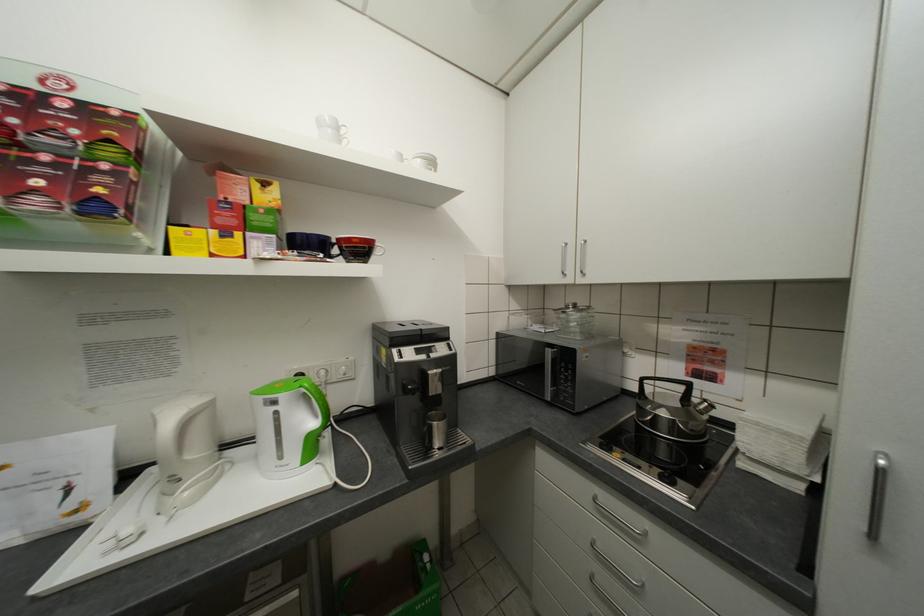
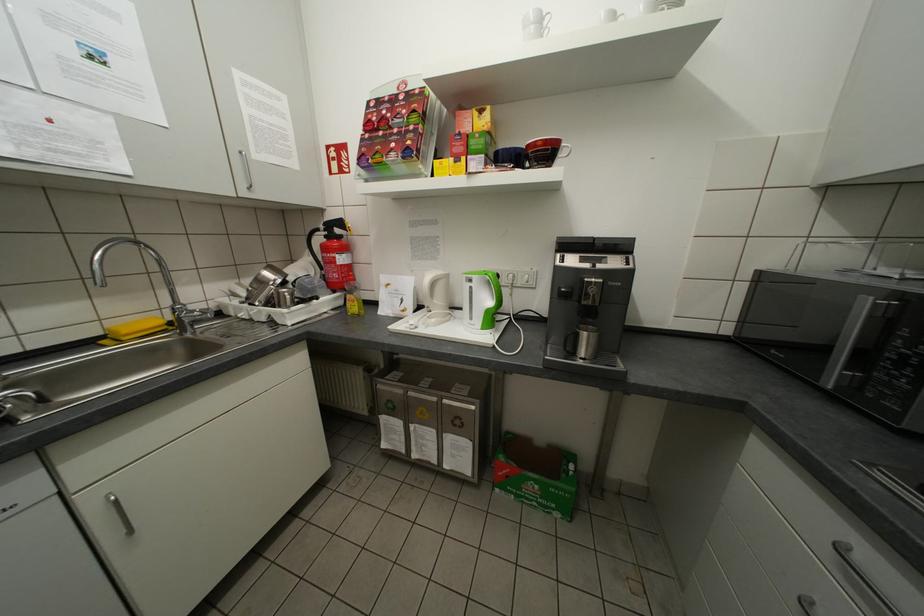
Question: I am providing you with two images of the same scene from different viewpoints. After the viewpoint changes to image2, which objects are now occluded?

Choices:
 (A) upper cabinet handle
 (B) dark blue mug
 (C) white mug
 (D) none of these

Answer: (D)